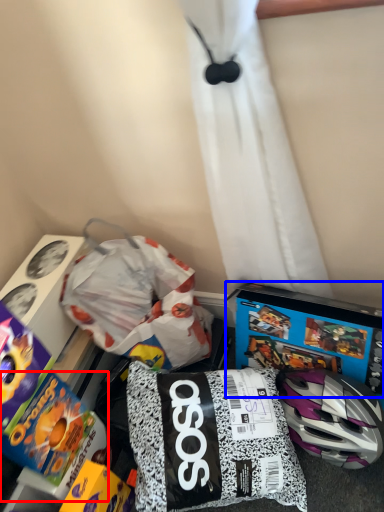
Question: Which of the following is the farthest to the observer, toy (highlighted by a red box) or video game (highlighted by a blue box)?

Choices:
 (A) toy
 (B) video game

Answer: (B)